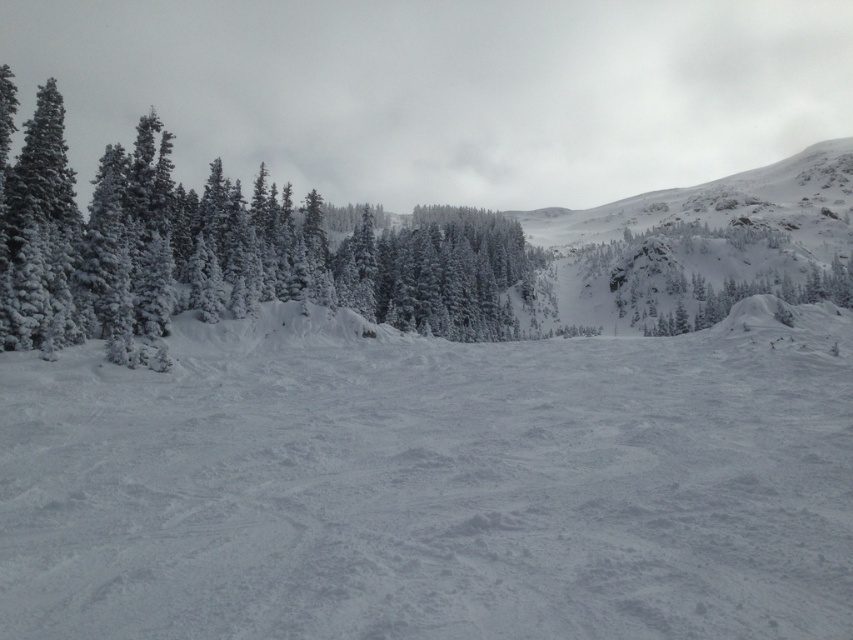
Which of these two, white snow at center or white frosty trees at left, stands taller?

Standing taller between the two is white frosty trees at left.

Who is shorter, white snow at center or white frosty trees at left?

Standing shorter between the two is white snow at center.

At what (x,y) coordinates should I click in order to perform the action: click on white snow at center. Please return your answer as a coordinate pair (x, y). Looking at the image, I should click on (433, 484).